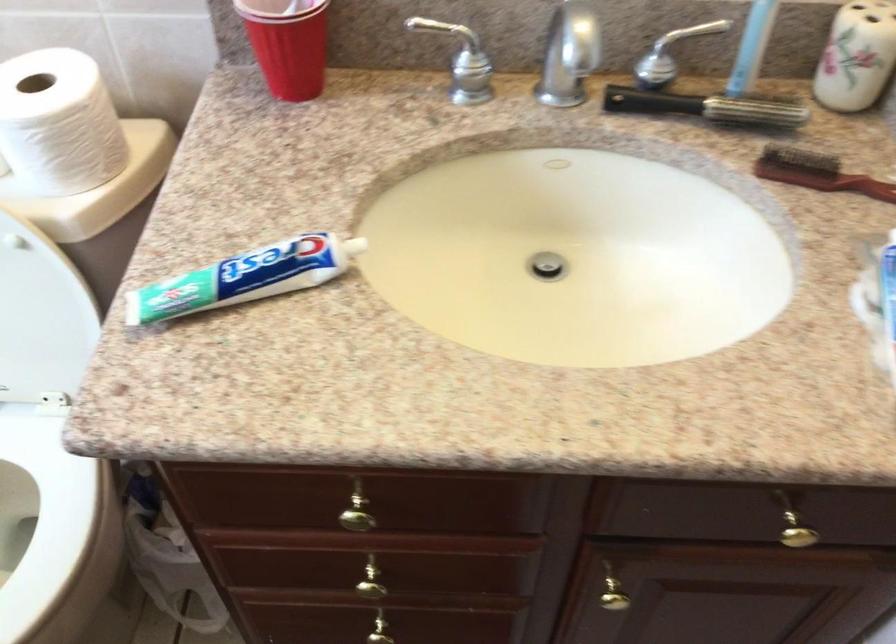
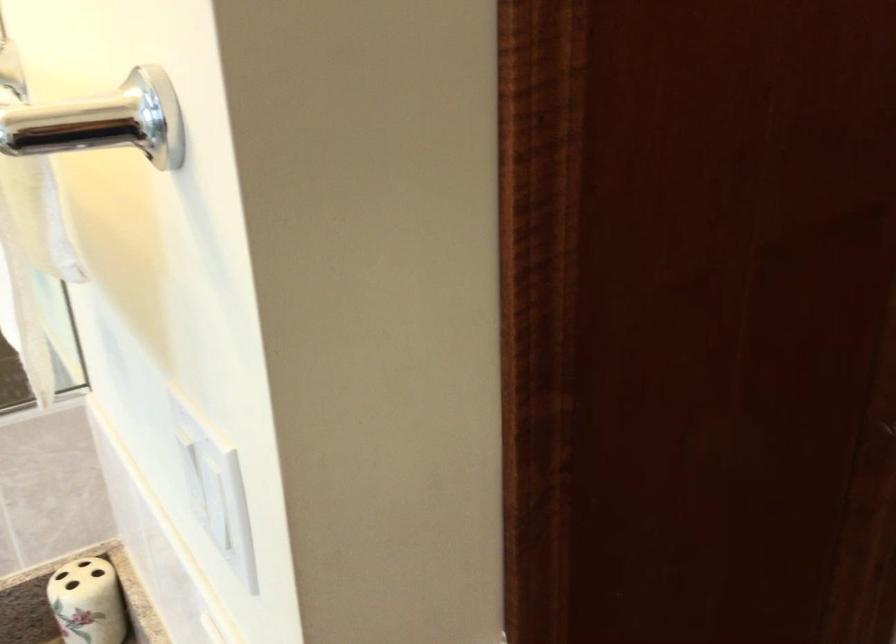
First-person continuous shooting, in which direction is the camera rotating?

The rotation direction of the camera is right-up.